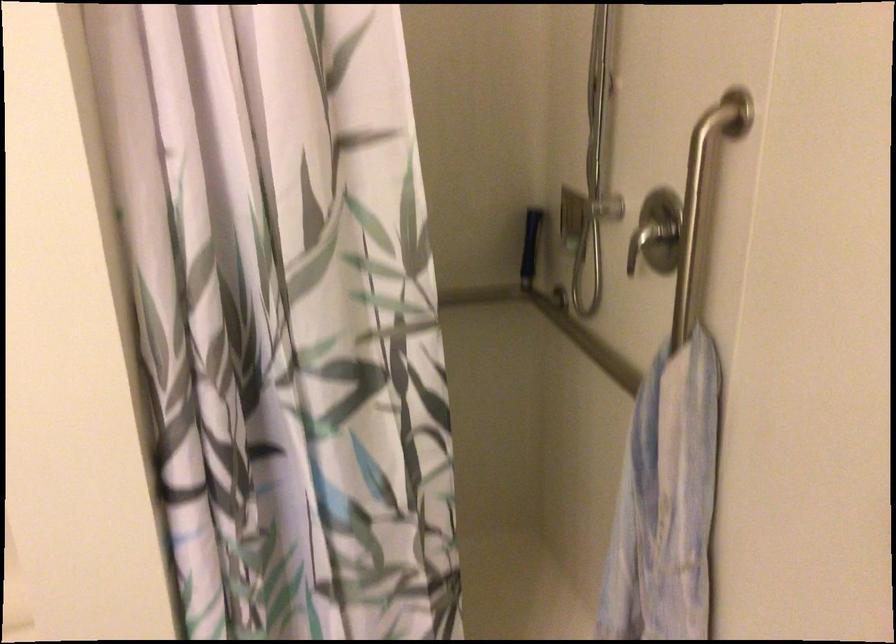
Find where to grip the handheld shower head. Please return your answer as a coordinate pair (x, y).

(593, 167)